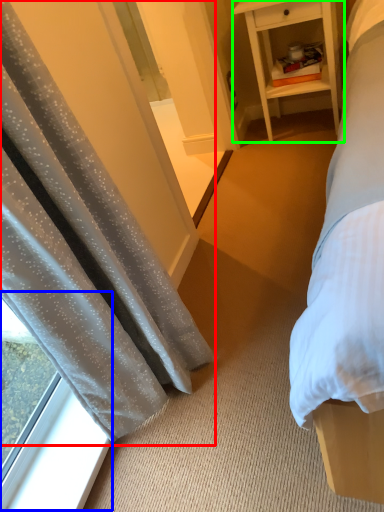
Question: Considering the real-world distances, which object is farthest from curtain (highlighted by a red box)? window (highlighted by a blue box) or nightstand (highlighted by a green box)?

Choices:
 (A) window
 (B) nightstand

Answer: (B)